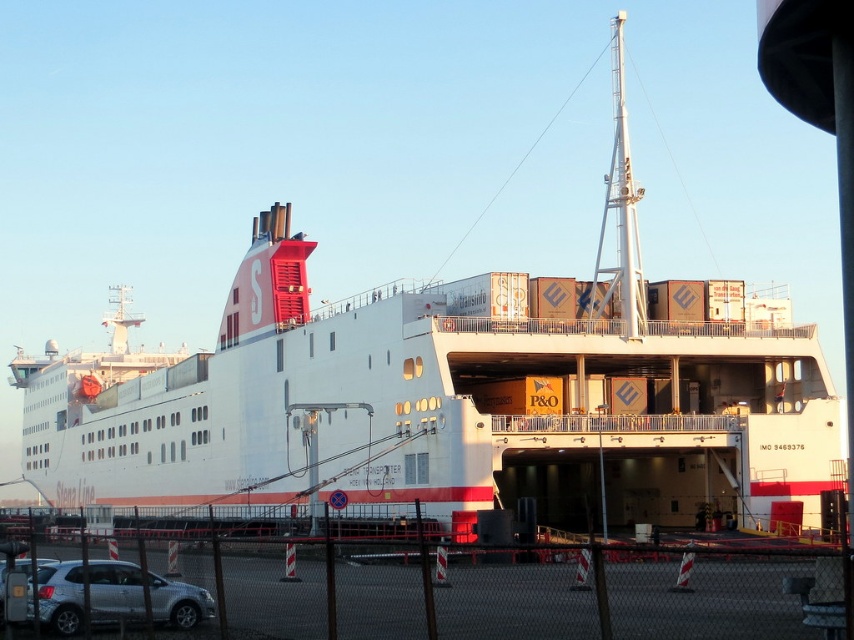
Question: Is metal mesh fence at lower center wider than silver metallic suv at lower left?

Choices:
 (A) no
 (B) yes

Answer: (B)

Question: Which point is farther to the camera?

Choices:
 (A) silver metallic suv at lower left
 (B) metal mesh fence at lower center

Answer: (A)

Question: Considering the relative positions of silver metallic suv at lower left and silver metallic car at lower left in the image provided, where is silver metallic suv at lower left located with respect to silver metallic car at lower left?

Choices:
 (A) above
 (B) below

Answer: (B)

Question: Does metal mesh fence at lower center lie behind silver metallic suv at lower left?

Choices:
 (A) yes
 (B) no

Answer: (B)

Question: Estimate the real-world distances between objects in this image. Which object is farther from the silver metallic suv at lower left?

Choices:
 (A) metal mesh fence at lower center
 (B) silver metallic car at lower left

Answer: (A)

Question: Which point is closer to the camera?

Choices:
 (A) silver metallic suv at lower left
 (B) silver metallic car at lower left

Answer: (A)